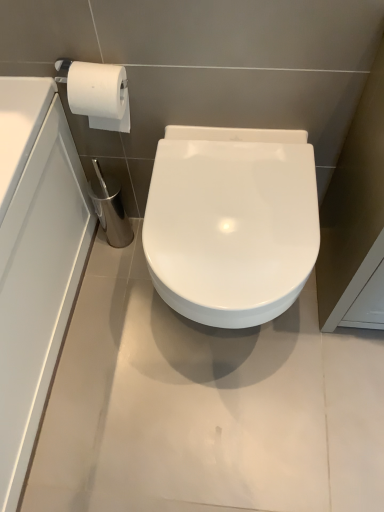
Question: Should I look upward or downward to see white glossy toilet at center?

Choices:
 (A) down
 (B) up

Answer: (B)